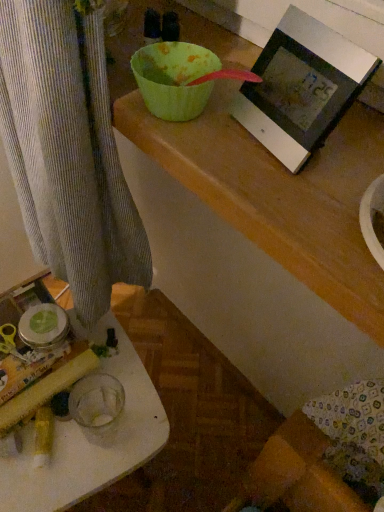
Find the location of a particular element. This screenshot has height=512, width=384. blank space situated above white plastic table at lower left (from a real-world perspective) is located at coordinates (75, 426).